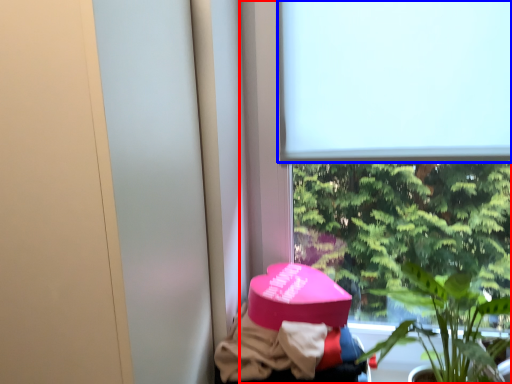
Question: Among these objects, which one is farthest to the camera, window (highlighted by a red box) or window screen (highlighted by a blue box)?

Choices:
 (A) window
 (B) window screen

Answer: (B)